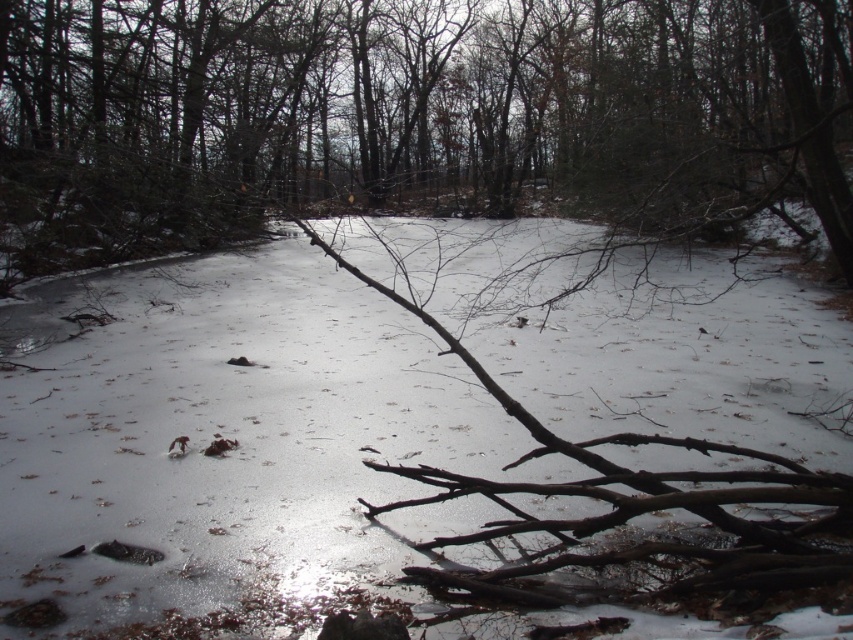
You are standing in a winter forest and see the white matte snow at center. If you want to place a 3 feet wide snowman on the snow, will it fit?

The white matte snow at center is 8.64 feet wide, so a 3 feet wide snowman can fit comfortably on it.

You are a hiker trying to cross the forest path. You see the white matte snow at center and the brown rough branch at center. Which one is closer to your current position?

The white matte snow at center and brown rough branch at center are 10.68 feet apart, but without additional information about their positions relative to your starting point, it is impossible to determine which is closer.